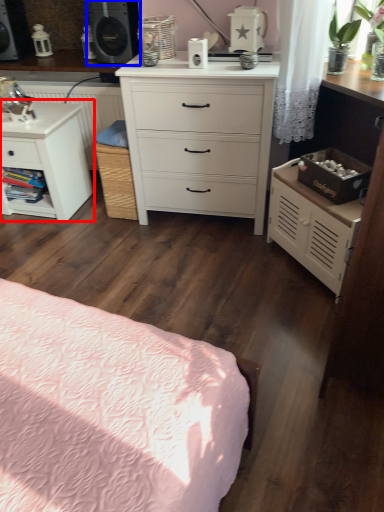
Question: Among these objects, which one is nearest to the camera, nightstand (highlighted by a red box) or speaker (highlighted by a blue box)?

Choices:
 (A) nightstand
 (B) speaker

Answer: (A)